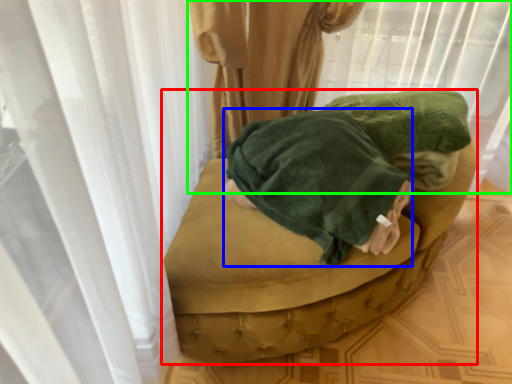
Question: Which object is positioned farthest from furniture (highlighted by a red box)? Select from clothing (highlighted by a blue box) and curtain (highlighted by a green box).

Choices:
 (A) clothing
 (B) curtain

Answer: (B)